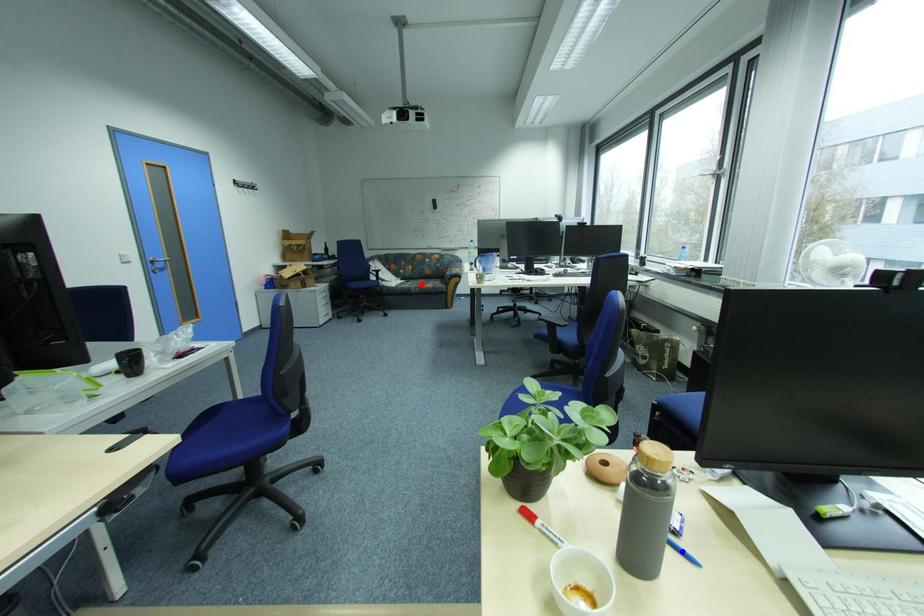
Question: In the image, two points are highlighted. Which point is nearer to the camera? Reply with the corresponding letter.

Choices:
 (A) blue point
 (B) red point

Answer: (A)